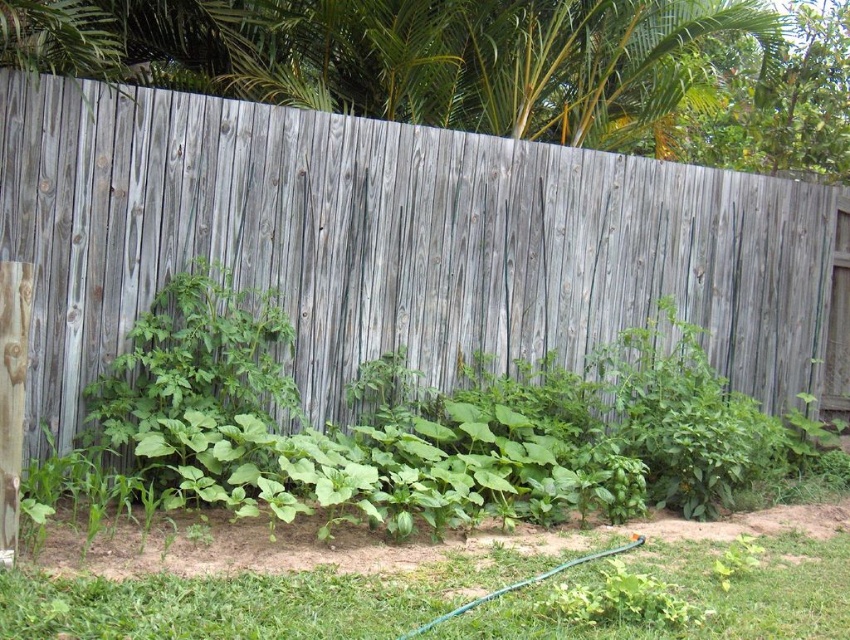
You are a gardener who needs to water the green grass at lower center and the green rubber hose at lower center. You have a watering can with a 24 inch long handle. Can you reach both objects from your current position without moving your feet?

The distance between the green grass at lower center and the green rubber hose at lower center is 22.98 inches. Since the watering can has a 24 inch handle, you can reach both objects without moving your feet as the handle is longer than the distance between them.

Based on the photo, you are standing in the backyard garden and want to locate the weathered wood fence at center. Where exactly is it positioned in the image?

The weathered wood fence at center is located at point (x=400, y=243).

You are a gardener who needs to water the plants near the fence. You see the green grass at lower center and the green rubber hose at lower center. Which object is taller and needs to be moved first to access the hose?

The green grass at lower center is taller than the green rubber hose at lower center, so you should move the green grass at lower center first to access the hose.